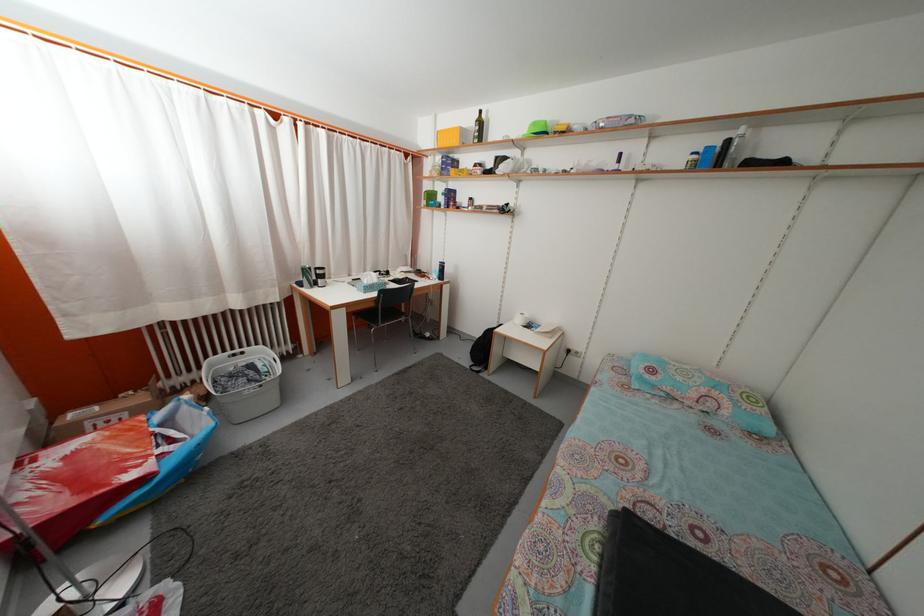
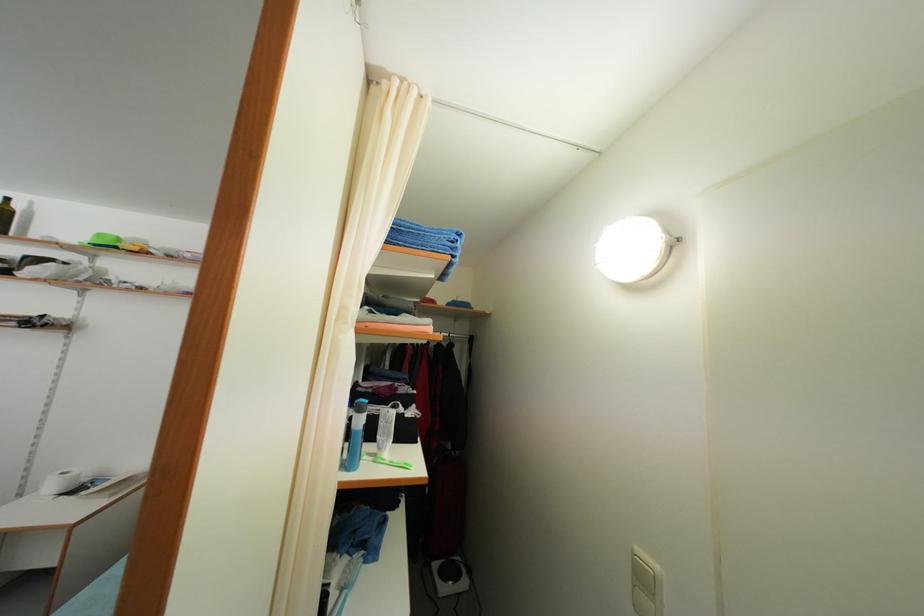
Find the pixel in the second image that matches (540,131) in the first image.

(104, 243)